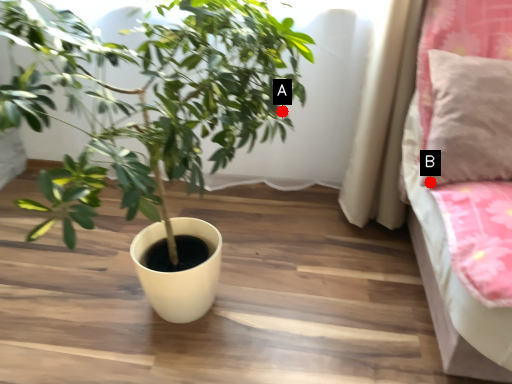
Question: Two points are circled on the image, labeled by A and B beside each circle. Which point is closer to the camera?

Choices:
 (A) A is closer
 (B) B is closer

Answer: (B)